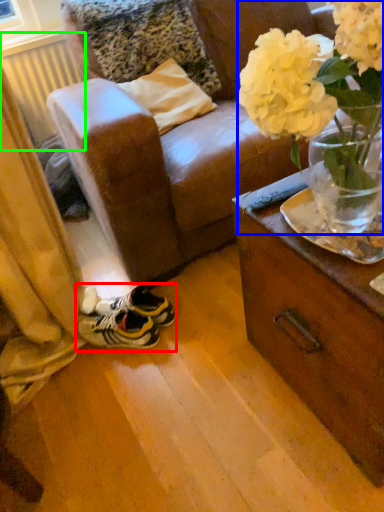
Question: Which object is the closest to the footwear (highlighted by a red box)? Choose among these: floral arrangement (highlighted by a blue box) or radiator (highlighted by a green box).

Choices:
 (A) floral arrangement
 (B) radiator

Answer: (A)